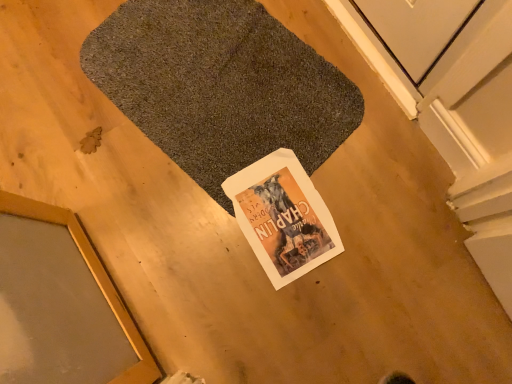
Locate an element on the screen. vacant region to the right of white paper magazine at center is located at coordinates (374, 189).